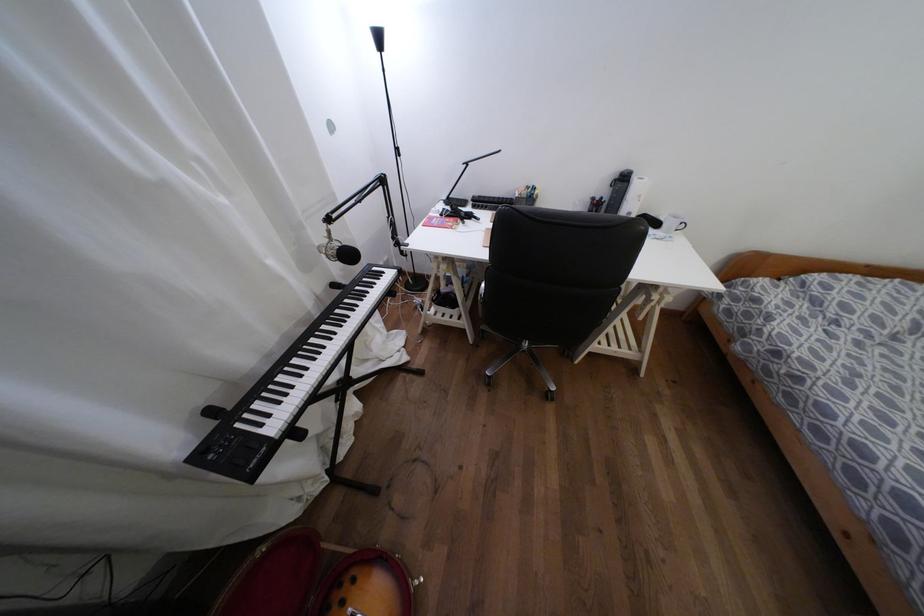
Find where to grasp the white mug handle. Please return your answer as a coordinate pair (x, y).

(672, 224)